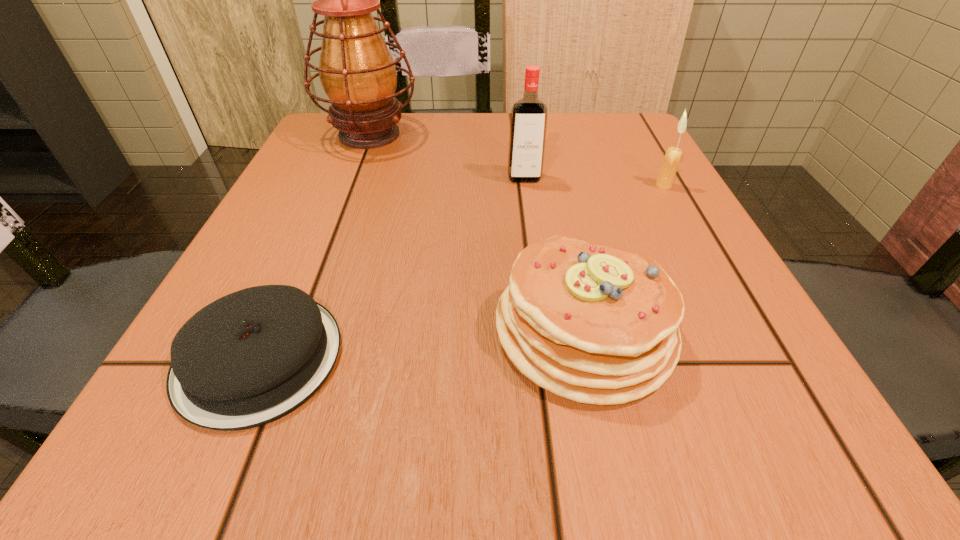
Where is `vacant point located between the second shortest object and the shortest object`? The image size is (960, 540). vacant point located between the second shortest object and the shortest object is located at coordinates (421, 343).

This screenshot has width=960, height=540. Identify the location of vacant space that's between the shorter pancake and the fourth tallest object. (421, 343).

Where is `free space between the fourth tallest object and the oil lamp`? The height and width of the screenshot is (540, 960). free space between the fourth tallest object and the oil lamp is located at coordinates (477, 232).

Identify the location of vacant area between the left pancake and the vodka. (392, 268).

Find the location of `empty space that is in between the left pancake and the candle`. empty space that is in between the left pancake and the candle is located at coordinates (462, 272).

Find the location of a particular element. object that ranks as the third closest to the rightmost object is located at coordinates (357, 72).

Select which object is the closest to the right pancake. Please provide its 2D coordinates. Your answer should be formatted as a tuple, i.e. [(x, y)], where the tuple contains the x and y coordinates of a point satisfying the conditions above.

[(251, 357)]

What are the coordinates of `vacant area in the image that satisfies the following two spatial constraints: 1. on the front side of the rightmost object; 2. on the left side of the tallest object` in the screenshot? It's located at (349, 185).

The height and width of the screenshot is (540, 960). What are the coordinates of `free region that satisfies the following two spatial constraints: 1. on the front and back of the vodka; 2. on the right side of the fourth tallest object` in the screenshot? It's located at (545, 329).

Locate an element on the screen. This screenshot has height=540, width=960. free space that satisfies the following two spatial constraints: 1. on the front side of the fourth tallest object; 2. on the right side of the oil lamp is located at coordinates (294, 329).